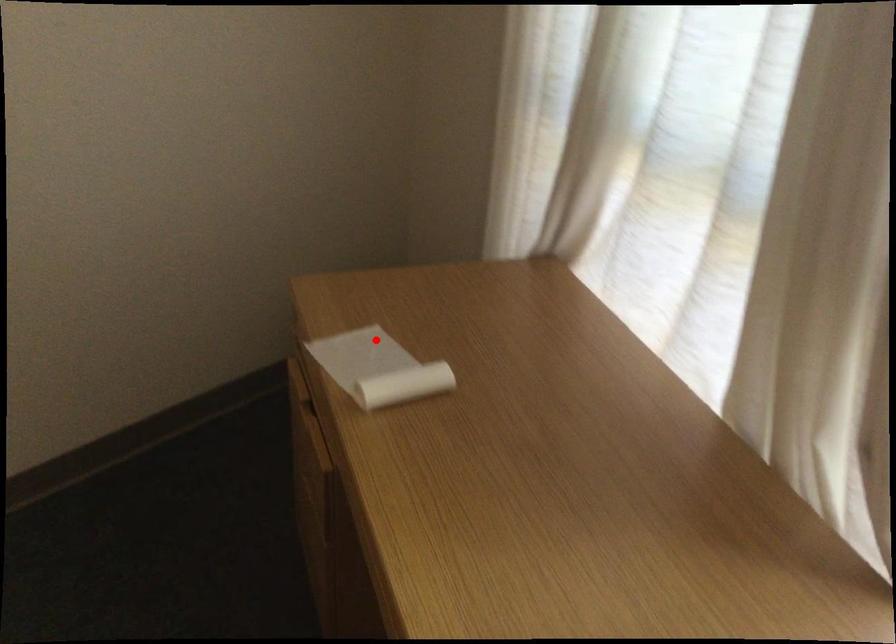
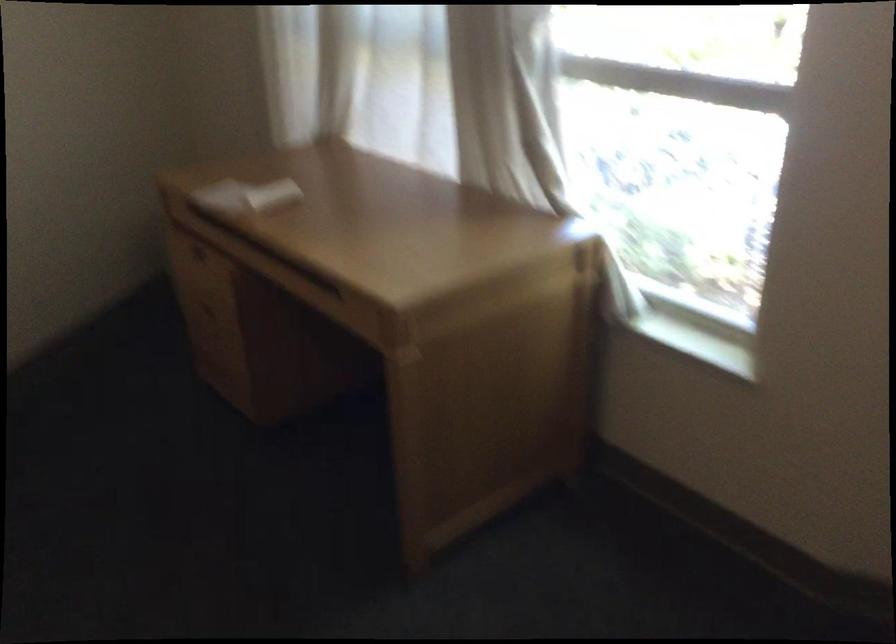
Question: I am providing you with two images of the same scene from different viewpoints. Image1 has a red point marked. In image2, the corresponding 3D location appears at what relative position? Reply with the corresponding letter.

Choices:
 (A) Closer
 (B) Farther

Answer: (B)